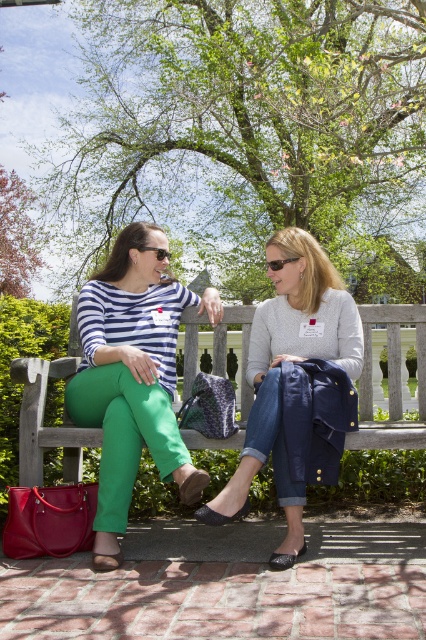
Is wooden bench at center wider than black plastic sunglasses at upper center?

Indeed, wooden bench at center has a greater width compared to black plastic sunglasses at upper center.

Does wooden bench at center have a smaller size compared to black plastic sunglasses at upper center?

Incorrect, wooden bench at center is not smaller in size than black plastic sunglasses at upper center.

At what (x,y) coordinates should I click in order to perform the action: click on wooden bench at center. Please return your answer as a coordinate pair (x, y). Image resolution: width=426 pixels, height=640 pixels. Looking at the image, I should click on (391, 380).

Is matte striped shirt at center taller than denim jacket at center?

Correct, matte striped shirt at center is much taller as denim jacket at center.

Which is behind, point (92, 417) or point (241, 509)?

The point (92, 417) is more distant.

What do you see at coordinates (132, 376) in the screenshot? This screenshot has width=426, height=640. I see `matte striped shirt at center` at bounding box center [132, 376].

You are a GUI agent. You are given a task and a screenshot of the screen. Output one action in this format:
    pyautogui.click(x=<x>, y=<y>)
    Task: Click on the matte striped shirt at center
    The width and height of the screenshot is (426, 640).
    Given the screenshot: What is the action you would take?
    pyautogui.click(x=132, y=376)

Who is positioned more to the left, matte striped shirt at center or black plastic sunglasses at center?

matte striped shirt at center is more to the left.

Can you confirm if matte striped shirt at center is smaller than black plastic sunglasses at center?

Incorrect, matte striped shirt at center is not smaller in size than black plastic sunglasses at center.

Describe the element at coordinates (132, 376) in the screenshot. The height and width of the screenshot is (640, 426). I see `matte striped shirt at center` at that location.

You are a GUI agent. You are given a task and a screenshot of the screen. Output one action in this format:
    pyautogui.click(x=<x>, y=<y>)
    Task: Click on the matte striped shirt at center
    The width and height of the screenshot is (426, 640).
    Given the screenshot: What is the action you would take?
    pyautogui.click(x=132, y=376)